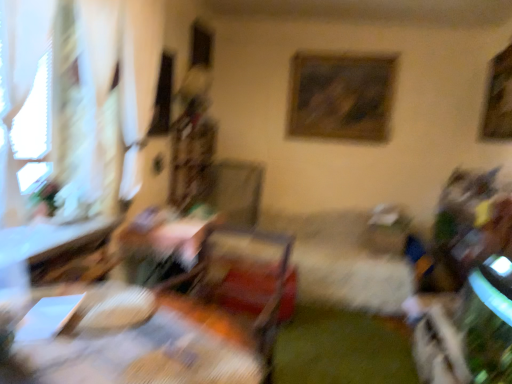
Question: Does white sheer curtain at left have a lesser height compared to wooden framed picture at upper right, the 1th picture frame positioned from the right?

Choices:
 (A) yes
 (B) no

Answer: (B)

Question: Is white sheer curtain at left not inside wooden framed picture at upper right, the 2th picture frame viewed from the left?

Choices:
 (A) yes
 (B) no

Answer: (A)

Question: Can you confirm if white sheer curtain at left is thinner than wooden framed picture at upper right, which is the 1th picture frame in front-to-back order?

Choices:
 (A) no
 (B) yes

Answer: (A)

Question: Is white sheer curtain at left wider than wooden framed picture at upper right, the 1th picture frame positioned from the right?

Choices:
 (A) yes
 (B) no

Answer: (A)

Question: Is white sheer curtain at left smaller than wooden framed picture at upper right, which is the 1th picture frame in front-to-back order?

Choices:
 (A) no
 (B) yes

Answer: (A)

Question: Does white sheer curtain at left contain wooden framed picture at upper right, the 2th picture frame viewed from the left?

Choices:
 (A) no
 (B) yes

Answer: (A)

Question: Is wooden table at center, marked as the second table in a back-to-front arrangement, at the back of wooden framed painting at upper center, the first picture frame from the left?

Choices:
 (A) no
 (B) yes

Answer: (A)

Question: Can you confirm if wooden framed painting at upper center, the first picture frame from the left, is wider than wooden table at center, marked as the second table in a back-to-front arrangement?

Choices:
 (A) yes
 (B) no

Answer: (B)

Question: Does wooden framed painting at upper center, the first picture frame from the left, have a larger size compared to wooden table at center, marked as the second table in a back-to-front arrangement?

Choices:
 (A) no
 (B) yes

Answer: (A)

Question: Could you tell me if wooden framed painting at upper center, which appears as the second picture frame when viewed from the front, is turned towards wooden table at center, placed as the 1th table when sorted from front to back?

Choices:
 (A) yes
 (B) no

Answer: (A)

Question: Considering the relative sizes of wooden framed painting at upper center, the first picture frame from the left, and wooden table at center, marked as the second table in a back-to-front arrangement, in the image provided, is wooden framed painting at upper center, the first picture frame from the left, thinner than wooden table at center, marked as the second table in a back-to-front arrangement,?

Choices:
 (A) no
 (B) yes

Answer: (B)

Question: Can you confirm if wooden framed painting at upper center, the first picture frame from the left, is taller than wooden table at center, placed as the 1th table when sorted from front to back?

Choices:
 (A) yes
 (B) no

Answer: (A)

Question: Does wooden swivel chair at center have a smaller size compared to wooden framed picture at upper right, the 1th picture frame positioned from the right?

Choices:
 (A) no
 (B) yes

Answer: (A)